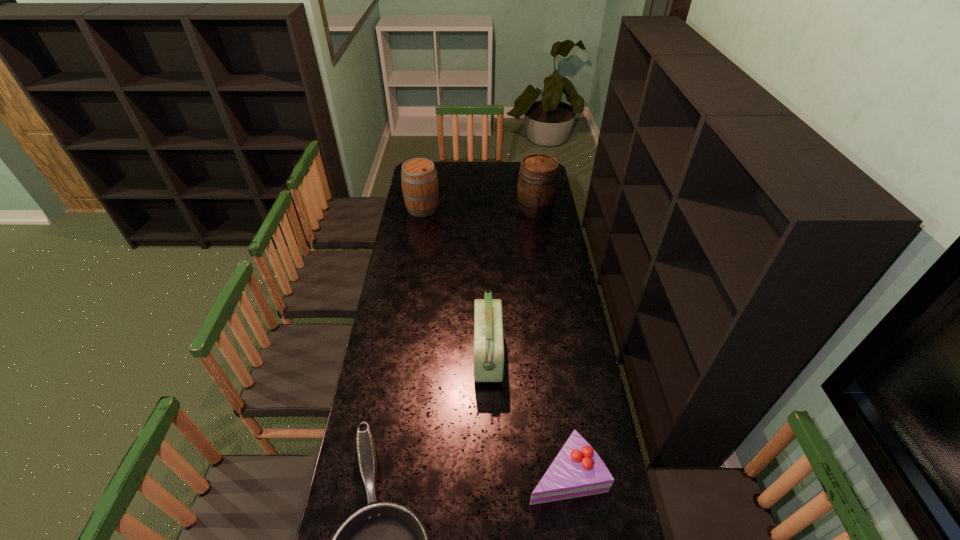
Where is `the right cider`? the right cider is located at coordinates (537, 183).

Locate an element on the screen. the left cider is located at coordinates (419, 180).

You are a GUI agent. You are given a task and a screenshot of the screen. Output one action in this format:
    pyautogui.click(x=<x>, y=<y>)
    Task: Click on the radio receiver
    This screenshot has width=960, height=540.
    Given the screenshot: What is the action you would take?
    pyautogui.click(x=488, y=350)

Find the location of `the third farthest object`. the third farthest object is located at coordinates (488, 350).

Where is `cake`? This screenshot has height=540, width=960. cake is located at coordinates (577, 470).

You are a GUI agent. You are given a task and a screenshot of the screen. Output one action in this format:
    pyautogui.click(x=<x>, y=<y>)
    Task: Click on the free space located on the side of the right cider near the bung hole
    
    Given the screenshot: What is the action you would take?
    pyautogui.click(x=540, y=239)

The width and height of the screenshot is (960, 540). I want to click on vacant space located on the front of the left cider, so click(418, 238).

You are a GUI agent. You are given a task and a screenshot of the screen. Output one action in this format:
    pyautogui.click(x=<x>, y=<y>)
    Task: Click on the vacant space positioned 0.140m on the front panel of the third nearest object
    The width and height of the screenshot is (960, 540).
    Given the screenshot: What is the action you would take?
    pyautogui.click(x=438, y=355)

This screenshot has width=960, height=540. I want to click on vacant space located 0.220m on the front panel of the third nearest object, so click(x=419, y=355).

Locate an element on the screen. The image size is (960, 540). vacant space situated on the front panel of the third nearest object is located at coordinates (378, 355).